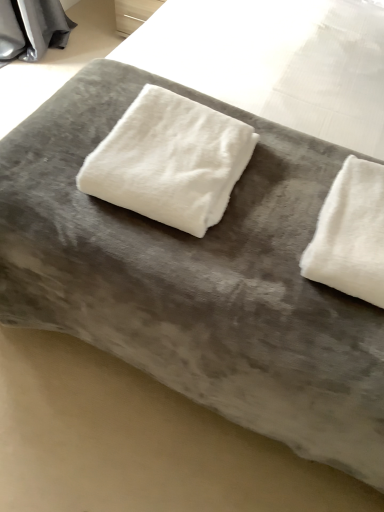
Locate an element on the screen. This screenshot has height=512, width=384. free space in front of white fluffy towel at right, the second towel from the left is located at coordinates (326, 330).